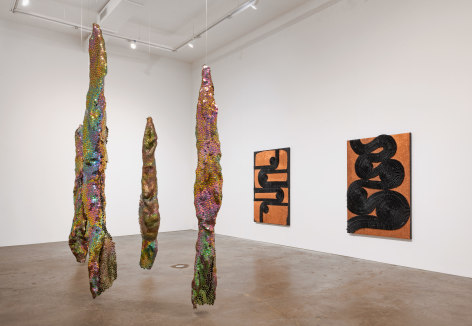
This screenshot has width=472, height=326. What are the coordinates of `canvas` in the screenshot? It's located at (267, 204).